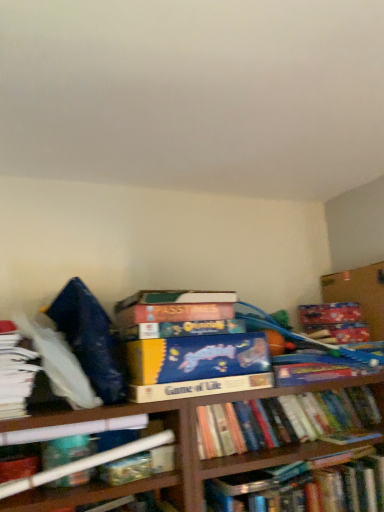
Question: From their relative heights in the image, would you say hardcover book at center, the second book from the bottom, is taller or shorter than hardcover book at lower left, which is the second book from top to bottom?

Choices:
 (A) short
 (B) tall

Answer: (A)

Question: Choose the correct answer: Is hardcover book at center, acting as the 3th book starting from the top, inside hardcover book at lower left, which is the second book from top to bottom, or outside it?

Choices:
 (A) outside
 (B) inside

Answer: (A)

Question: Which object is positioned closest to the hardcover book at lower left, the 3th book from the bottom?

Choices:
 (A) cardboard box at upper right
 (B) hardcover book at center, acting as the 3th book starting from the top
 (C) white paper at left, positioned as the 4th book in bottom-to-top order
 (D) hardcover book at center, placed as the 4th book when sorted from top to bottom

Answer: (C)

Question: Which object is positioned farthest from the hardcover book at lower left, the 3th book from the bottom?

Choices:
 (A) hardcover book at center, the first book positioned from the bottom
 (B) white paper at left, which is counted as the 1th book, starting from the top
 (C) cardboard box at upper right
 (D) hardcover book at center, the second book from the bottom

Answer: (C)